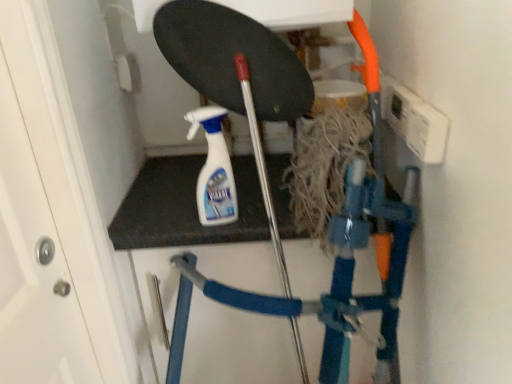
At what (x,y) coordinates should I click in order to perform the action: click on vacant space positioned to the left of white plastic spray bottle at center. Please return your answer as a coordinate pair (x, y). The width and height of the screenshot is (512, 384). Looking at the image, I should click on (158, 218).